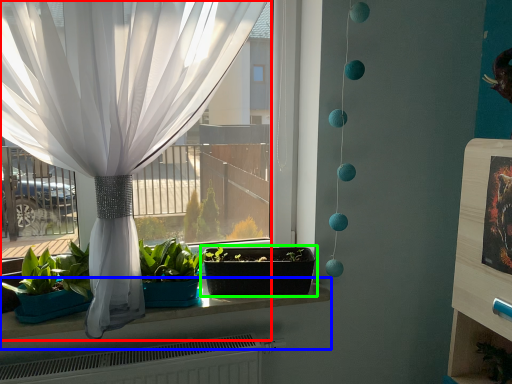
Question: Which object is the farthest from curtain (highlighted by a red box)? Choose among these: window sill (highlighted by a blue box) or flowerpot (highlighted by a green box).

Choices:
 (A) window sill
 (B) flowerpot

Answer: (A)